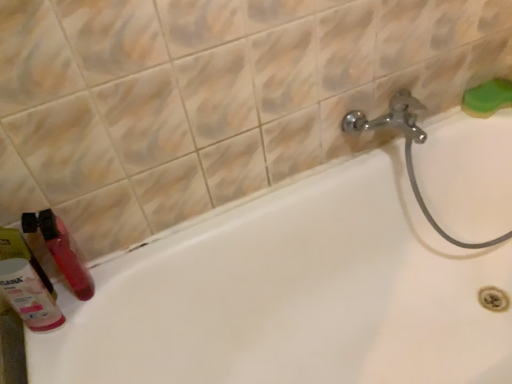
Question: From the image's perspective, is green sponge at upper right under matte pink bottle at lower left?

Choices:
 (A) no
 (B) yes

Answer: (A)

Question: Could you tell me if green sponge at upper right is turned towards matte pink bottle at lower left?

Choices:
 (A) no
 (B) yes

Answer: (A)

Question: Is green sponge at upper right taller than matte pink bottle at lower left?

Choices:
 (A) yes
 (B) no

Answer: (B)

Question: Is green sponge at upper right positioned with its back to matte pink bottle at lower left?

Choices:
 (A) no
 (B) yes

Answer: (A)

Question: Does green sponge at upper right contain matte pink bottle at lower left?

Choices:
 (A) yes
 (B) no

Answer: (B)

Question: Considering their positions, is matte pink bottle at lower left located in front of or behind green sponge at upper right?

Choices:
 (A) front
 (B) behind

Answer: (A)

Question: Would you say matte pink bottle at lower left is inside or outside green sponge at upper right?

Choices:
 (A) inside
 (B) outside

Answer: (B)

Question: In terms of width, does matte pink bottle at lower left look wider or thinner when compared to green sponge at upper right?

Choices:
 (A) wide
 (B) thin

Answer: (B)

Question: From a real-world perspective, is matte pink bottle at lower left physically located above or below green sponge at upper right?

Choices:
 (A) above
 (B) below

Answer: (A)

Question: Considering their positions, is green sponge at upper right located in front of or behind white glossy bathtub at lower left?

Choices:
 (A) behind
 (B) front

Answer: (A)

Question: Would you say green sponge at upper right is to the left or to the right of white glossy bathtub at lower left in the picture?

Choices:
 (A) right
 (B) left

Answer: (A)

Question: Do you think green sponge at upper right is within white glossy bathtub at lower left, or outside of it?

Choices:
 (A) outside
 (B) inside

Answer: (A)

Question: From their relative heights in the image, would you say green sponge at upper right is taller or shorter than white glossy bathtub at lower left?

Choices:
 (A) short
 (B) tall

Answer: (A)

Question: From the image's perspective, is matte pink bottle at lower left above or below matte plastic toothbrush at lower left?

Choices:
 (A) below
 (B) above

Answer: (A)

Question: Does point (49, 324) appear closer or farther from the camera than point (30, 309)?

Choices:
 (A) farther
 (B) closer

Answer: (A)